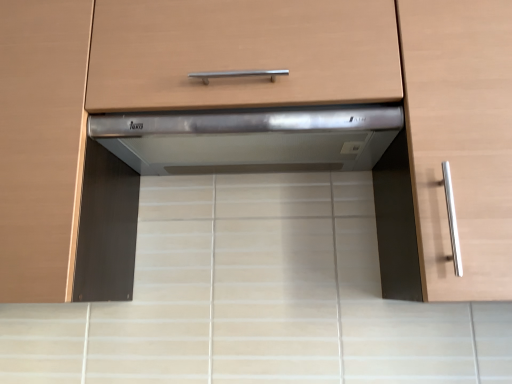
Question: Is there a large distance between satin silver drawer at center and satin wood cabinet handle at right, arranged as the second cabinetry when viewed from the left?

Choices:
 (A) yes
 (B) no

Answer: (B)

Question: Considering the relative sizes of satin silver drawer at center and satin wood cabinet handle at right, the 1th cabinetry when ordered from right to left, in the image provided, is satin silver drawer at center smaller than satin wood cabinet handle at right, the 1th cabinetry when ordered from right to left,?

Choices:
 (A) no
 (B) yes

Answer: (B)

Question: Considering the relative sizes of satin silver drawer at center and satin wood cabinet handle at right, arranged as the second cabinetry when viewed from the left, in the image provided, is satin silver drawer at center shorter than satin wood cabinet handle at right, arranged as the second cabinetry when viewed from the left,?

Choices:
 (A) no
 (B) yes

Answer: (B)

Question: Is satin silver drawer at center positioned before satin wood cabinet handle at right, the 1th cabinetry when ordered from right to left?

Choices:
 (A) no
 (B) yes

Answer: (A)

Question: Does satin silver drawer at center have a greater width compared to satin wood cabinet handle at right, the 1th cabinetry when ordered from right to left?

Choices:
 (A) yes
 (B) no

Answer: (B)

Question: Based on their positions, is satin silver range hood at center located to the left or right of satin silver metallic range hood at center, marked as the 1th cabinetry in a left-to-right arrangement?

Choices:
 (A) left
 (B) right

Answer: (B)

Question: Is satin silver range hood at center in front of or behind satin silver metallic range hood at center, the second cabinetry viewed from the right, in the image?

Choices:
 (A) behind
 (B) front

Answer: (A)

Question: From the image's perspective, is satin silver range hood at center above or below satin silver metallic range hood at center, marked as the 1th cabinetry in a left-to-right arrangement?

Choices:
 (A) below
 (B) above

Answer: (A)

Question: From their relative heights in the image, would you say satin silver range hood at center is taller or shorter than satin silver metallic range hood at center, the second cabinetry viewed from the right?

Choices:
 (A) tall
 (B) short

Answer: (B)

Question: Is satin silver range hood at center inside the boundaries of satin silver drawer at center, or outside?

Choices:
 (A) inside
 (B) outside

Answer: (B)

Question: From the image's perspective, is satin silver range hood at center above or below satin silver drawer at center?

Choices:
 (A) above
 (B) below

Answer: (B)

Question: Is satin silver range hood at center wider or thinner than satin silver drawer at center?

Choices:
 (A) thin
 (B) wide

Answer: (A)

Question: Is satin silver range hood at center bigger or smaller than satin silver drawer at center?

Choices:
 (A) big
 (B) small

Answer: (B)

Question: Relative to satin silver range hood at center, is satin silver metallic range hood at center, the second cabinetry viewed from the right, in front or behind?

Choices:
 (A) behind
 (B) front

Answer: (B)

Question: Does point (80, 163) appear closer or farther from the camera than point (391, 107)?

Choices:
 (A) farther
 (B) closer

Answer: (A)